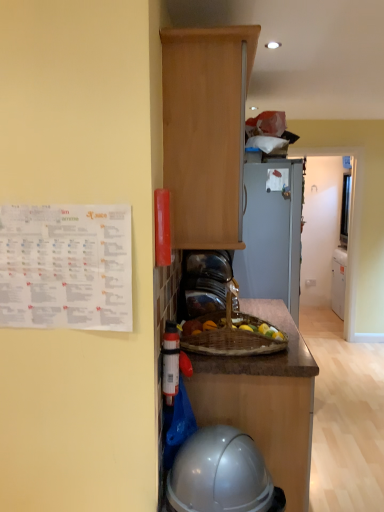
Question: From a real-world perspective, is brown polished wood at center above or below wooden cabinet at upper center?

Choices:
 (A) below
 (B) above

Answer: (A)

Question: Is brown polished wood at center bigger or smaller than wooden cabinet at upper center?

Choices:
 (A) small
 (B) big

Answer: (A)

Question: Estimate the real-world distances between objects in this image. Which object is farther from the glossy plastic helmet at lower center?

Choices:
 (A) brown polished wood at center
 (B) wooden cabinet at upper center

Answer: (B)

Question: Estimate the real-world distances between objects in this image. Which object is farther from the brown polished wood at center?

Choices:
 (A) glossy plastic helmet at lower center
 (B) wooden cabinet at upper center

Answer: (B)